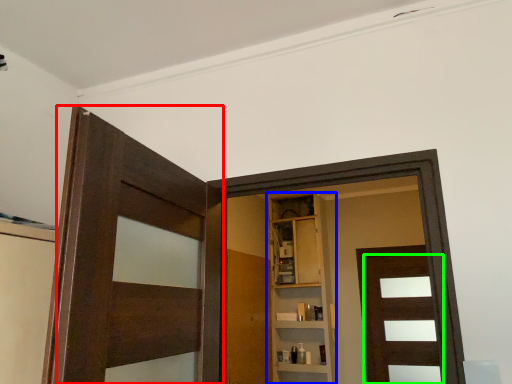
Question: Considering the real-world distances, which object is closest to door (highlighted by a red box)? cabinetry (highlighted by a blue box) or door (highlighted by a green box).

Choices:
 (A) cabinetry
 (B) door

Answer: (A)